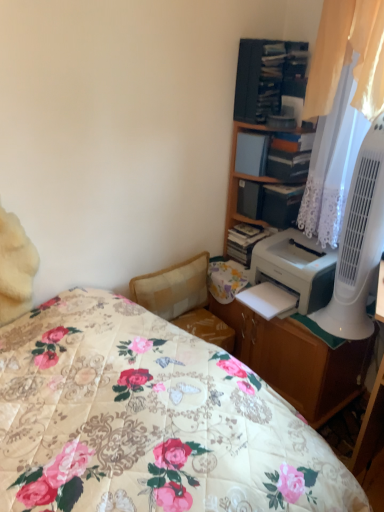
The height and width of the screenshot is (512, 384). What are the coordinates of `vacant space underneath white plastic fan at right (from a real-world perspective)` in the screenshot? It's located at (341, 325).